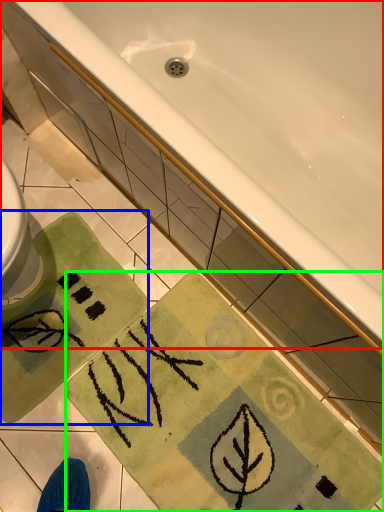
Question: Considering the real-world distances, which object is farthest from bathtub (highlighted by a red box)? beach towel (highlighted by a blue box) or beach towel (highlighted by a green box)?

Choices:
 (A) beach towel
 (B) beach towel

Answer: (A)